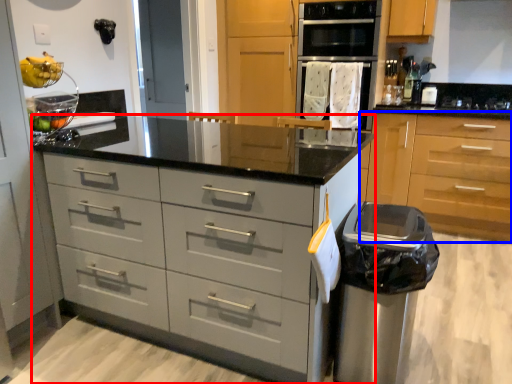
Question: Which point is further to the camera, chest of drawers (highlighted by a red box) or cabinetry (highlighted by a blue box)?

Choices:
 (A) chest of drawers
 (B) cabinetry

Answer: (B)